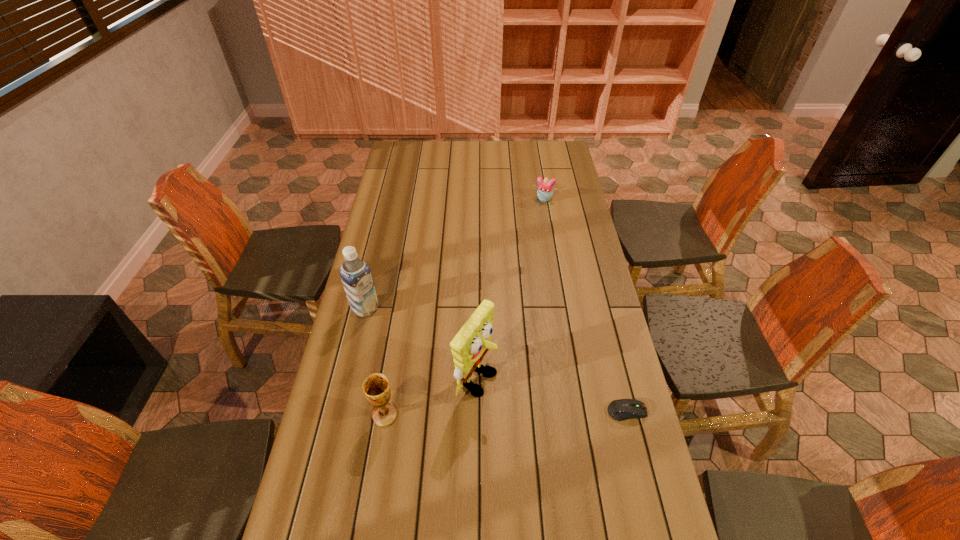
Locate an element on the screen. the third shortest object is located at coordinates pos(376,387).

Find the location of a particular element. chalice is located at coordinates (376, 387).

The height and width of the screenshot is (540, 960). I want to click on computer equipment, so [623, 409].

I want to click on the rightmost object, so click(x=623, y=409).

Identify the location of soya milk. This screenshot has height=540, width=960. (355, 274).

Locate an element on the screen. the leftmost object is located at coordinates (355, 274).

What are the coordinates of `sponge` in the screenshot? It's located at (469, 346).

Where is `the fourth object from left to right`? the fourth object from left to right is located at coordinates (545, 190).

The image size is (960, 540). Find the location of `the farthest object`. the farthest object is located at coordinates (545, 190).

I want to click on vacant space located on the right of the chalice, so click(x=429, y=415).